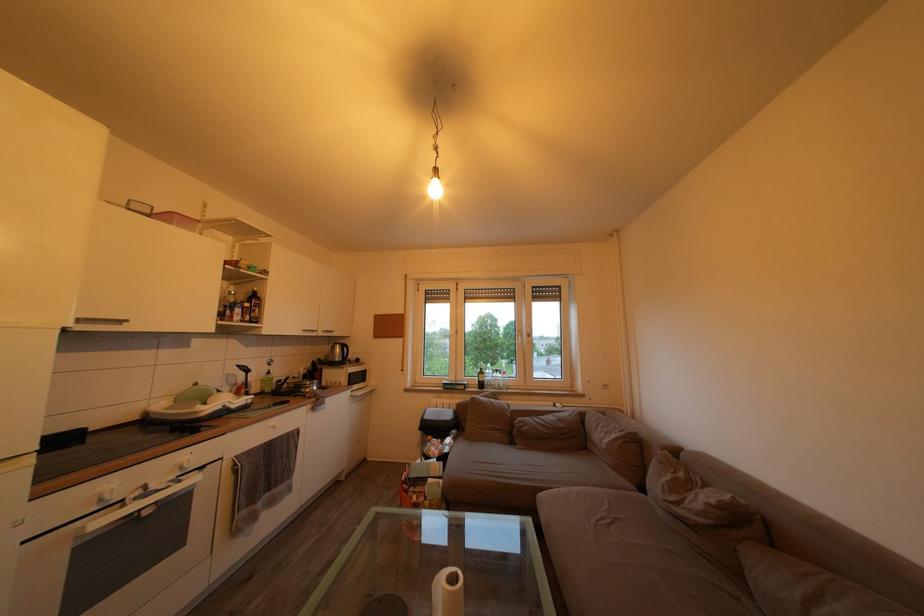
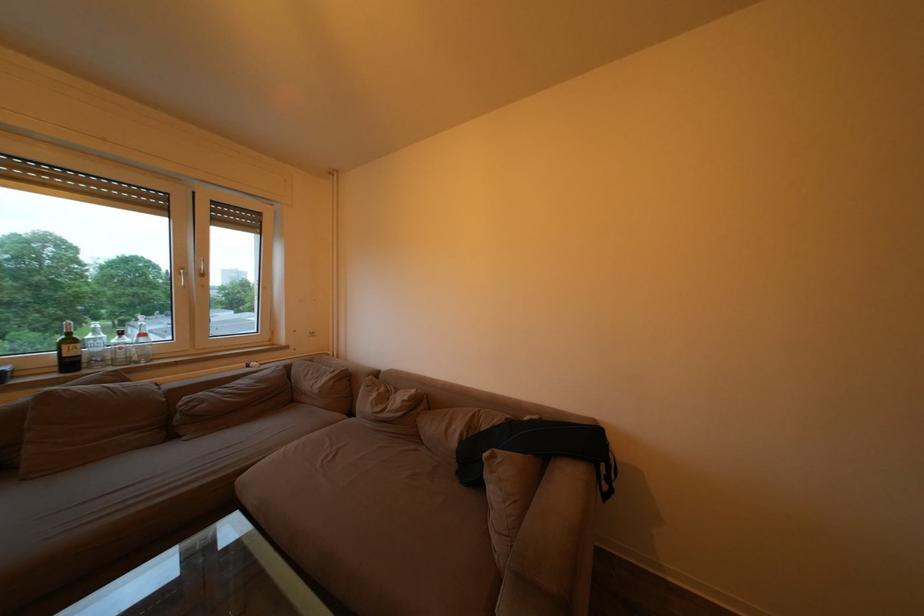
In the second image, find the point that corresponds to [612,419] in the first image.

(319, 367)